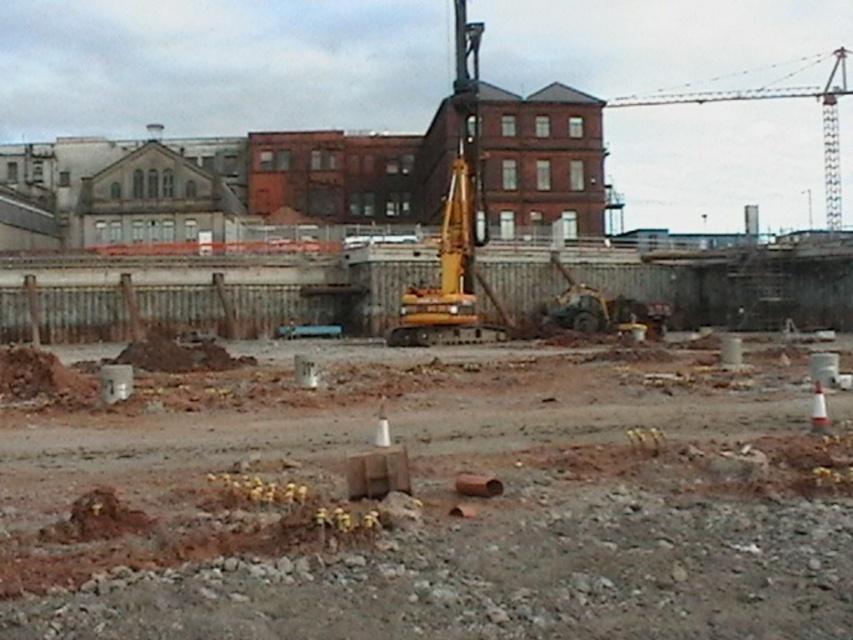
Does point (474, 230) come in front of point (804, 97)?

Yes, it is.

Locate an element on the screen. yellow rubber excavator at center is located at coordinates (450, 268).

This screenshot has width=853, height=640. I want to click on yellow rubber excavator at center, so click(x=450, y=268).

Does brown gravel at center appear under yellow metallic crane at upper right?

Indeed, brown gravel at center is positioned under yellow metallic crane at upper right.

Who is more distant from viewer, (827, 572) or (834, 148)?

The point (834, 148) is more distant.

Identify the location of brown gravel at center. The width and height of the screenshot is (853, 640). (440, 512).

Is point (223, 564) closer to camera compared to point (491, 333)?

That is True.

Can you confirm if brown gravel at center is wider than yellow rubber excavator at center?

Yes.

Identify the location of brown gravel at center. The image size is (853, 640). (440, 512).

You are a GUI agent. You are given a task and a screenshot of the screen. Output one action in this format:
    pyautogui.click(x=<x>, y=<y>)
    Task: Click on the brown gravel at center
    This screenshot has height=640, width=853.
    Given the screenshot: What is the action you would take?
    coord(440,512)